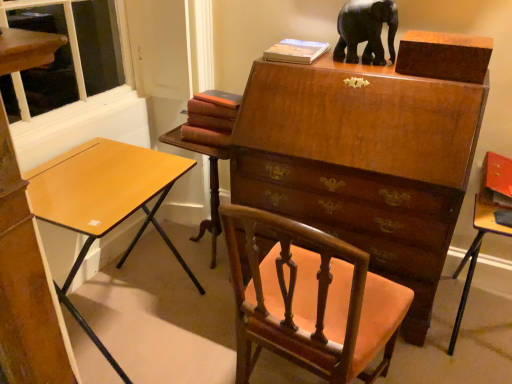
Question: Is the surface of hardcover book at upper center, placed as the 1th book when sorted from right to left, in direct contact with light brown wood desk at left?

Choices:
 (A) no
 (B) yes

Answer: (A)

Question: Does hardcover book at upper center, the 2th book ordered from the bottom, have a greater width compared to light brown wood desk at left?

Choices:
 (A) no
 (B) yes

Answer: (A)

Question: Is hardcover book at upper center, acting as the 1th book starting from the top, thinner than light brown wood desk at left?

Choices:
 (A) yes
 (B) no

Answer: (A)

Question: From the image's perspective, does hardcover book at upper center, the 2th book ordered from the bottom, appear lower than light brown wood desk at left?

Choices:
 (A) yes
 (B) no

Answer: (B)

Question: Considering the relative sizes of hardcover book at upper center, the 2th book positioned from the left, and light brown wood desk at left in the image provided, is hardcover book at upper center, the 2th book positioned from the left, smaller than light brown wood desk at left?

Choices:
 (A) no
 (B) yes

Answer: (B)

Question: Looking at the image, does matte orange table at right, which is the 1th table from right to left, seem bigger or smaller compared to mahogany wood chair at center?

Choices:
 (A) small
 (B) big

Answer: (A)

Question: Would you say matte orange table at right, which is the 1th table from right to left, is to the left or to the right of mahogany wood chair at center in the picture?

Choices:
 (A) right
 (B) left

Answer: (A)

Question: Considering their positions, is matte orange table at right, which is the 1th table from right to left, located in front of or behind mahogany wood chair at center?

Choices:
 (A) behind
 (B) front

Answer: (A)

Question: Is matte orange table at right, which is the 1th table from right to left, spatially inside mahogany wood chair at center, or outside of it?

Choices:
 (A) outside
 (B) inside

Answer: (A)

Question: From a real-world perspective, is black glossy elephant at upper center positioned above or below hardcover book at upper center, acting as the 1th book starting from the top?

Choices:
 (A) below
 (B) above

Answer: (B)

Question: Is point (353, 34) closer or farther from the camera than point (278, 59)?

Choices:
 (A) farther
 (B) closer

Answer: (B)

Question: Looking at the image, does black glossy elephant at upper center seem bigger or smaller compared to hardcover book at upper center, the 2th book positioned from the left?

Choices:
 (A) small
 (B) big

Answer: (B)

Question: In the image, is black glossy elephant at upper center on the left side or the right side of hardcover book at upper center, placed as the 1th book when sorted from right to left?

Choices:
 (A) left
 (B) right

Answer: (B)

Question: In terms of height, does maroon leather book at center, which ranks as the 1th book in left-to-right order, look taller or shorter compared to mahogany wood table at center, which appears as the 2th table when viewed from the right?

Choices:
 (A) short
 (B) tall

Answer: (A)

Question: From the image's perspective, is maroon leather book at center, the 2th book viewed from the top, above or below mahogany wood table at center, which appears as the 2th table when viewed from the right?

Choices:
 (A) above
 (B) below

Answer: (A)